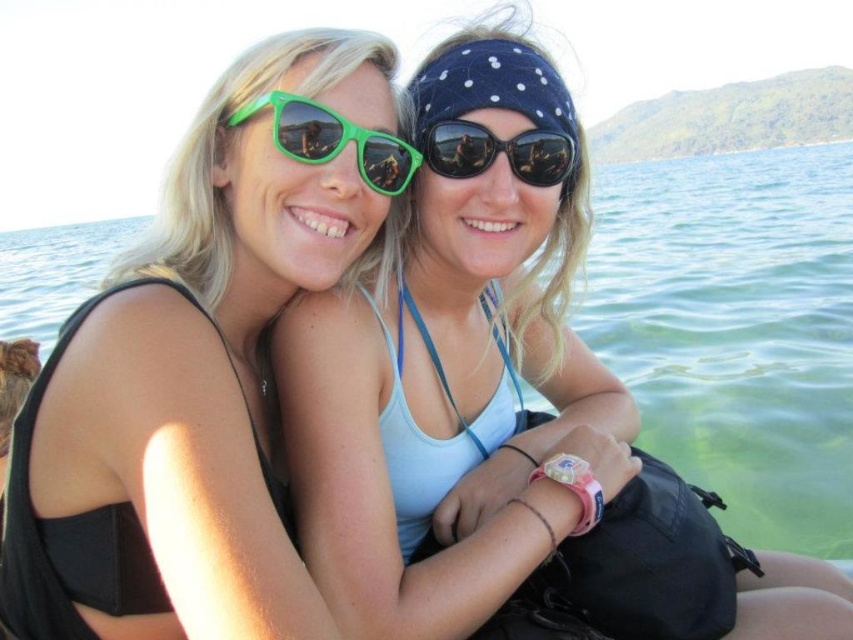
Between point (459, 268) and point (567, 150), which one is positioned in front?

Point (567, 150) is more forward.

Is point (436, 83) farther from camera compared to point (442, 138)?

That is True.

Locate an element on the screen. The width and height of the screenshot is (853, 640). matte green sunglasses at center is located at coordinates (497, 413).

Is matte green sunglasses at center shorter than clear blue water at left?

Yes.

Does point (322, 326) come farther from viewer compared to point (3, 312)?

No, it is in front of (3, 312).

Identify the location of matte green sunglasses at center. (497, 413).

Describe the element at coordinates (735, 330) in the screenshot. I see `green translucent water at center` at that location.

Does green translucent water at center have a greater height compared to clear blue water at left?

Incorrect, green translucent water at center's height is not larger of clear blue water at left's.

Between point (834, 161) and point (21, 248), which one is positioned behind?

Positioned behind is point (21, 248).

The width and height of the screenshot is (853, 640). I want to click on green translucent water at center, so click(735, 330).